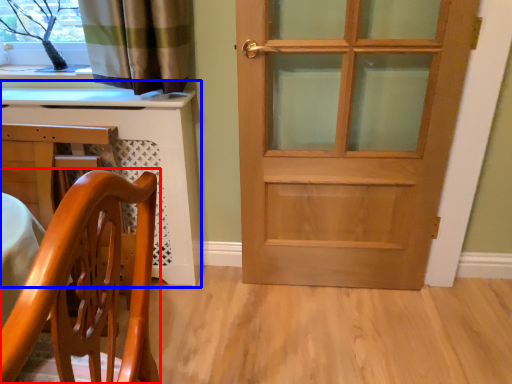
Question: Which point is closer to the camera, chair (highlighted by a red box) or computer desk (highlighted by a blue box)?

Choices:
 (A) chair
 (B) computer desk

Answer: (A)